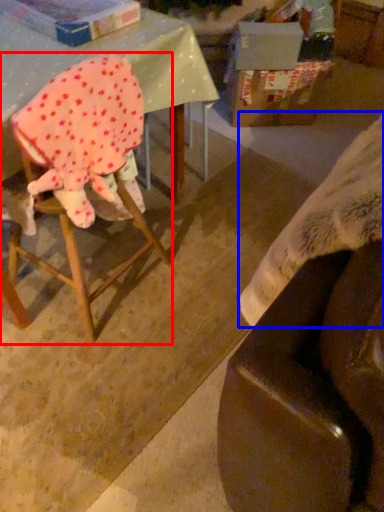
Question: Which point is further to the camera, chair (highlighted by a red box) or blanket (highlighted by a blue box)?

Choices:
 (A) chair
 (B) blanket

Answer: (A)